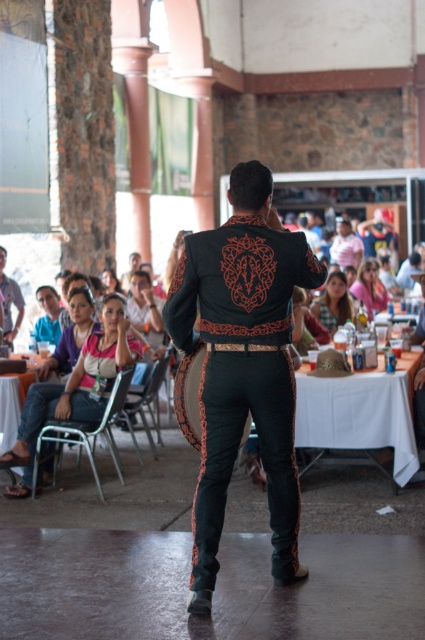
Question: Among these objects, which one is nearest to the camera?

Choices:
 (A) matte blue shirt at left
 (B) metallic gray chair at lower left
 (C) denim jeans at lower left

Answer: (B)

Question: Which point appears farthest from the camera in this image?

Choices:
 (A) coord(351,257)
 (B) coord(56,433)

Answer: (A)

Question: Does matte black dress at center have a larger size compared to pink fabric at upper center?

Choices:
 (A) no
 (B) yes

Answer: (A)

Question: Considering the relative positions of black leather mariachi outfit at center and pink fabric at upper center in the image provided, where is black leather mariachi outfit at center located with respect to pink fabric at upper center?

Choices:
 (A) below
 (B) above

Answer: (A)

Question: Which point appears closest to the camera in this image?

Choices:
 (A) (359, 268)
 (B) (96, 340)

Answer: (B)

Question: In this image, where is pink fabric at upper center located relative to matte pink shirt at upper center?

Choices:
 (A) left
 (B) right

Answer: (A)